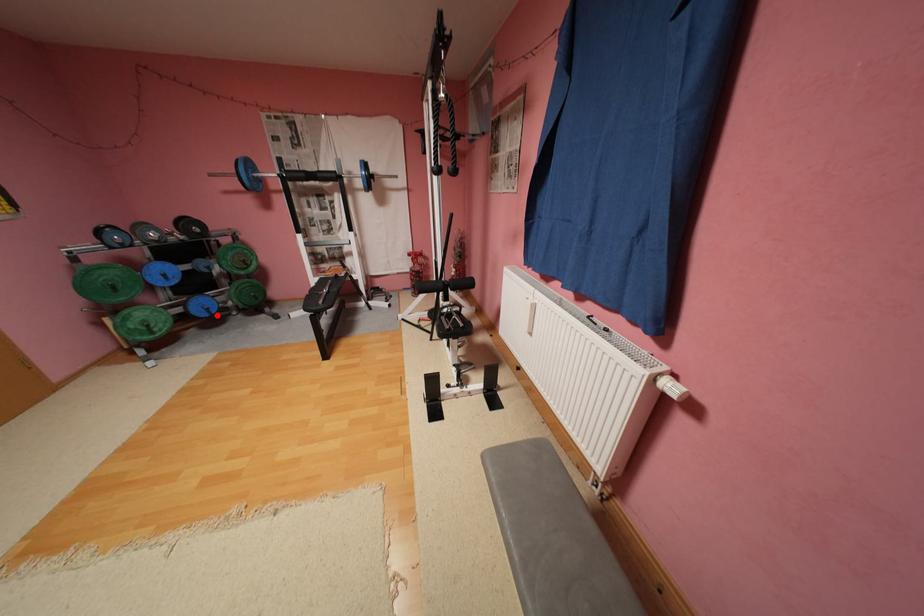
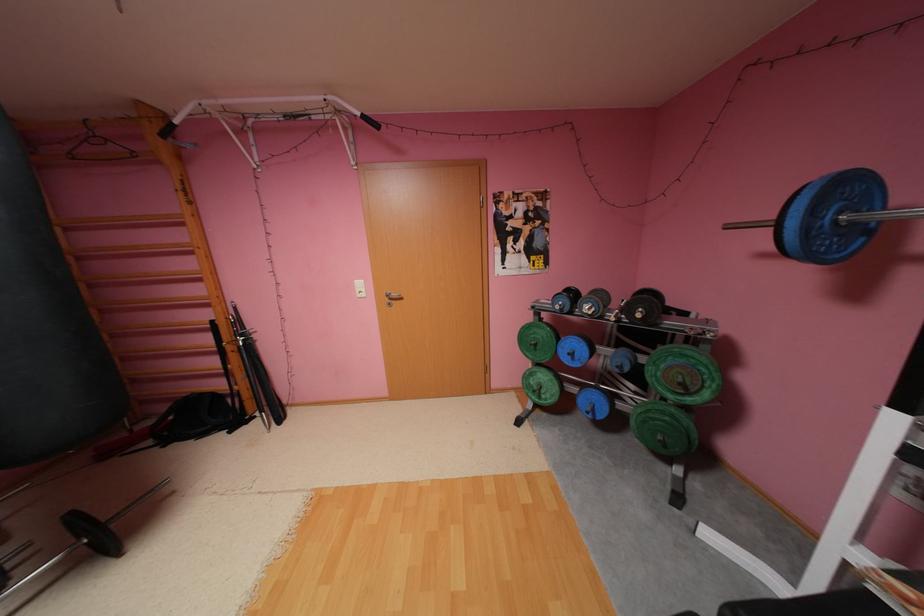
Question: A red point is marked in image1. In image2, is the corresponding 3D point closer to the camera or farther? Reply with the corresponding letter.

Choices:
 (A) The corresponding 3D point is closer.
 (B) The corresponding 3D point is farther.

Answer: (B)